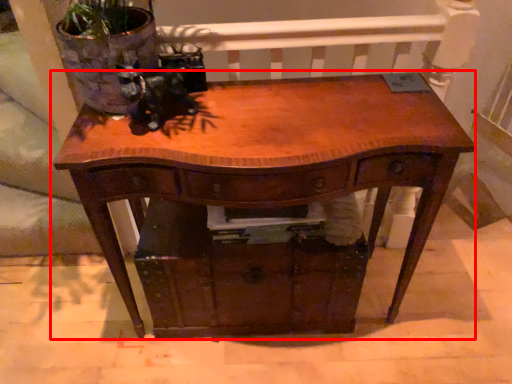
Question: From the image's perspective, where is table (annotated by the red box) located relative to drawer?

Choices:
 (A) below
 (B) above

Answer: (B)